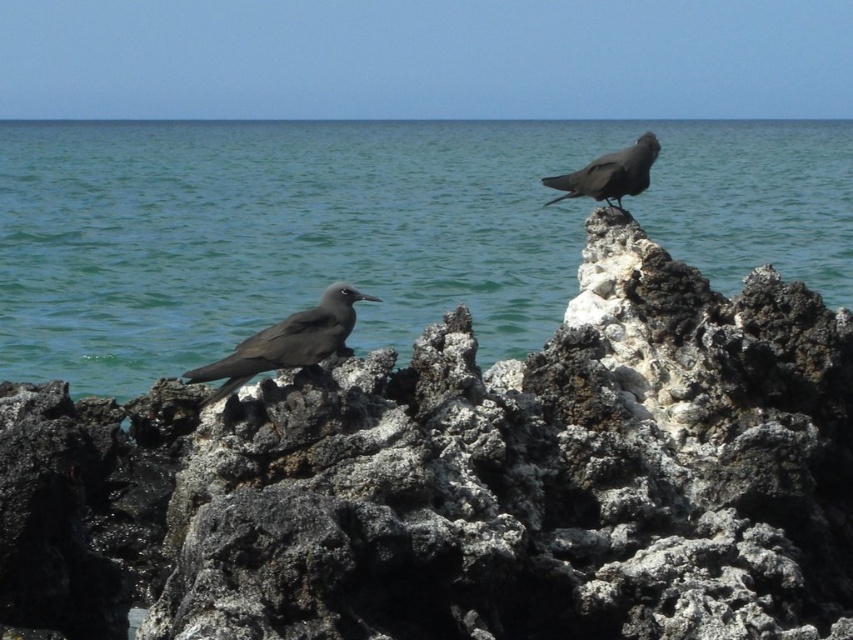
Question: Is rough textured rock at center smaller than matte black bird at lower left?

Choices:
 (A) no
 (B) yes

Answer: (A)

Question: Which point is closer to the camera taking this photo?

Choices:
 (A) (828, 582)
 (B) (656, 152)
 (C) (653, 228)
 (D) (331, 324)

Answer: (D)

Question: Considering the relative positions of matte black bird at lower left and matte black bird at upper right in the image provided, where is matte black bird at lower left located with respect to matte black bird at upper right?

Choices:
 (A) above
 (B) below

Answer: (B)

Question: Is blue water at center wider than matte black bird at upper right?

Choices:
 (A) no
 (B) yes

Answer: (B)

Question: Which object is farther from the camera taking this photo?

Choices:
 (A) matte black bird at lower left
 (B) rough textured rock at center
 (C) blue water at center

Answer: (C)

Question: Which point appears farthest from the camera in this image?

Choices:
 (A) (44, 141)
 (B) (216, 362)
 (C) (624, 172)

Answer: (A)